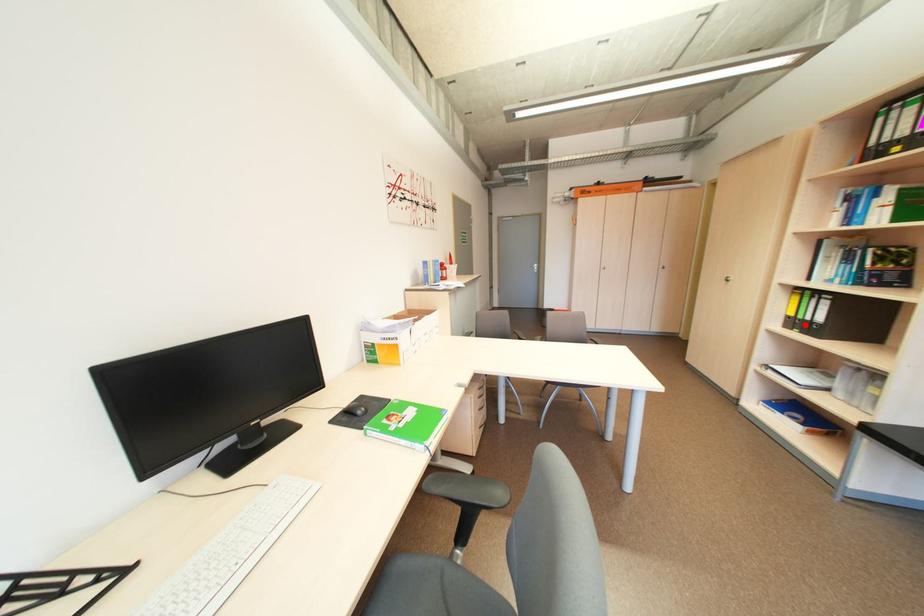
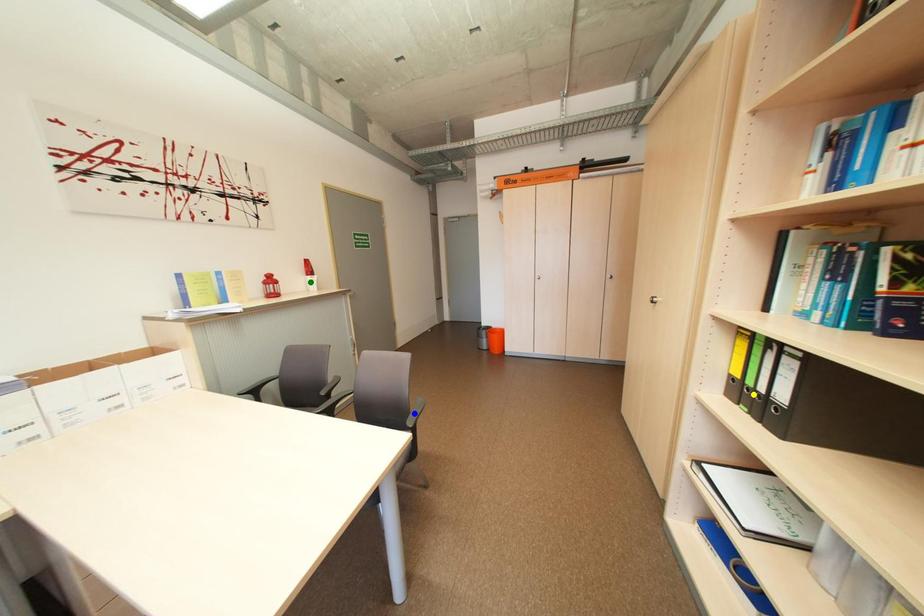
Question: I am providing you with two images of the same scene from different viewpoints. A red point is marked on the first image. You are given multiple points on the second image. Which point in image 2 is actually the same real-world point as the red point in image 1?

Choices:
 (A) blue point
 (B) green point
 (C) yellow point

Answer: (C)